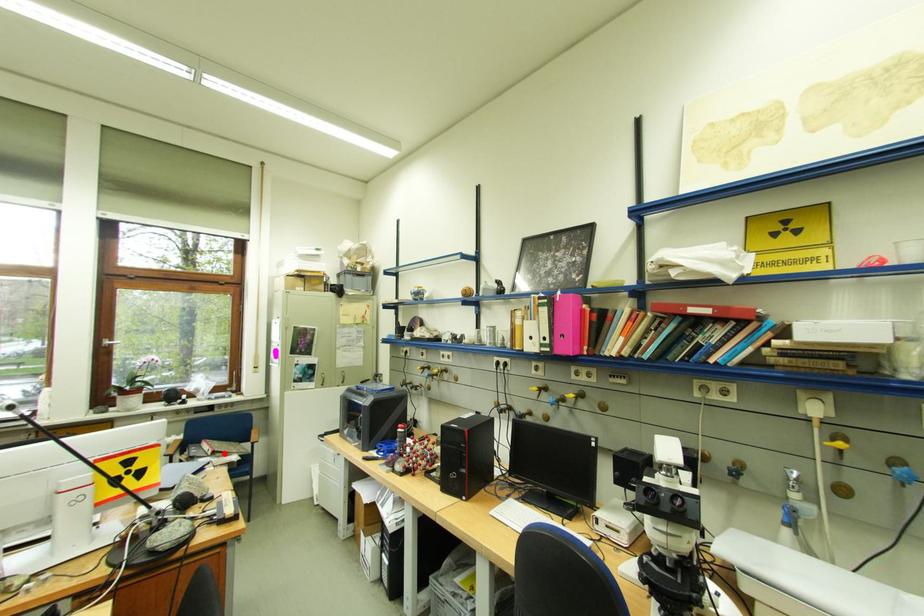
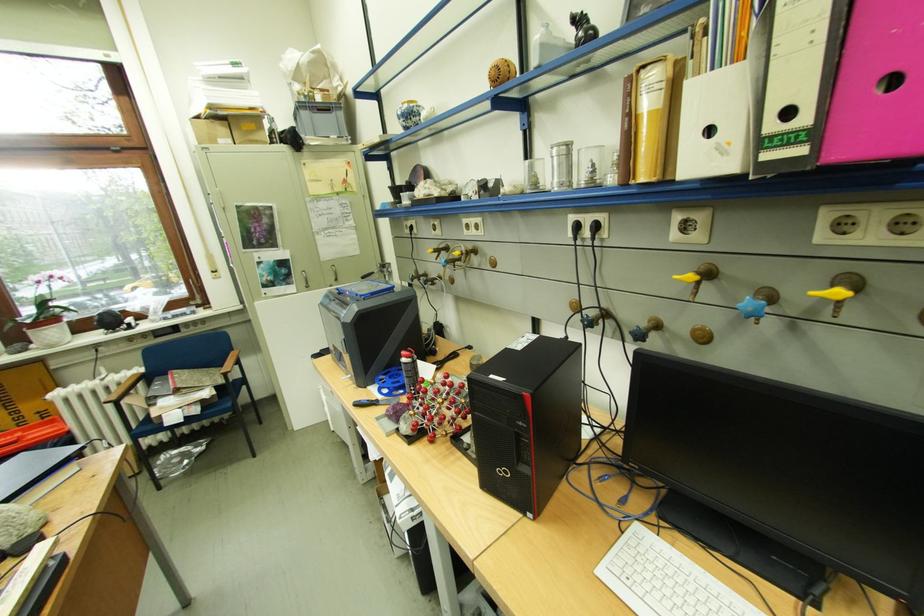
Locate, in the second image, the point that corresponds to the highlighted location in the first image.

(187, 392)